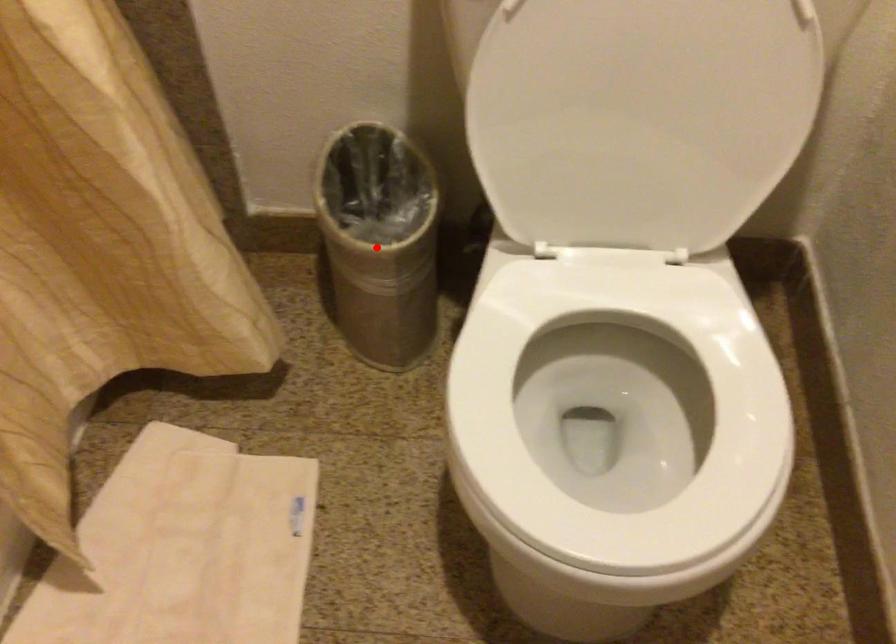
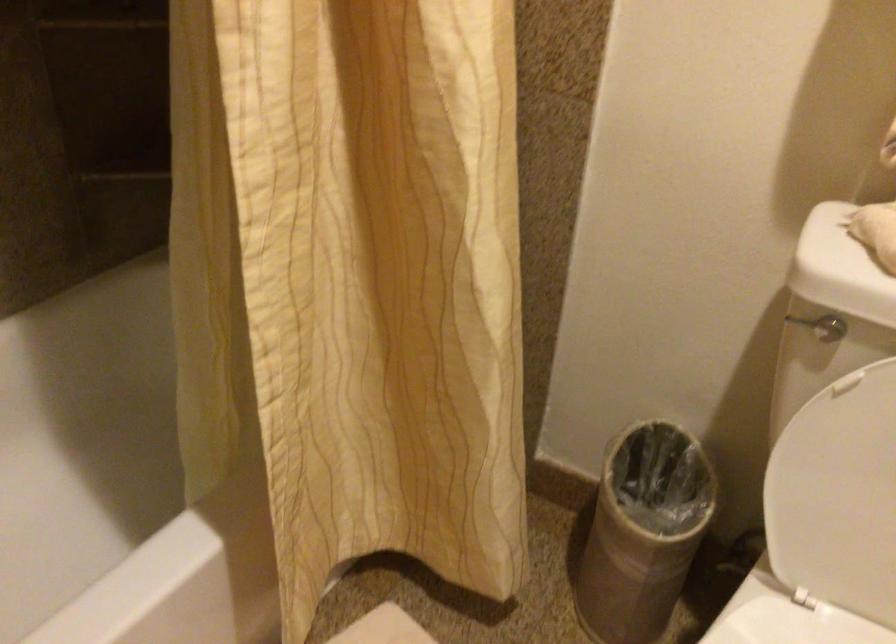
Find the pixel in the second image that matches the highlighted location in the first image.

(643, 532)